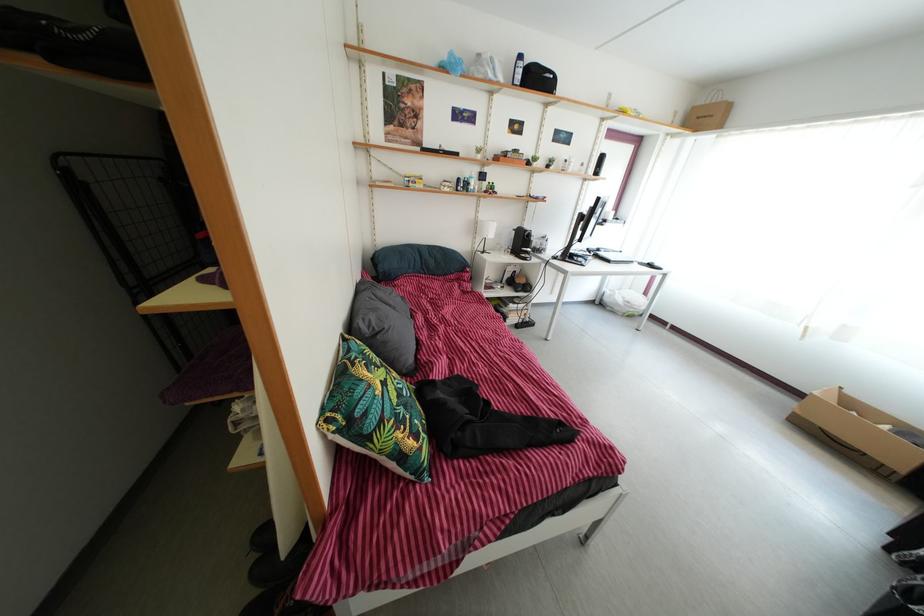
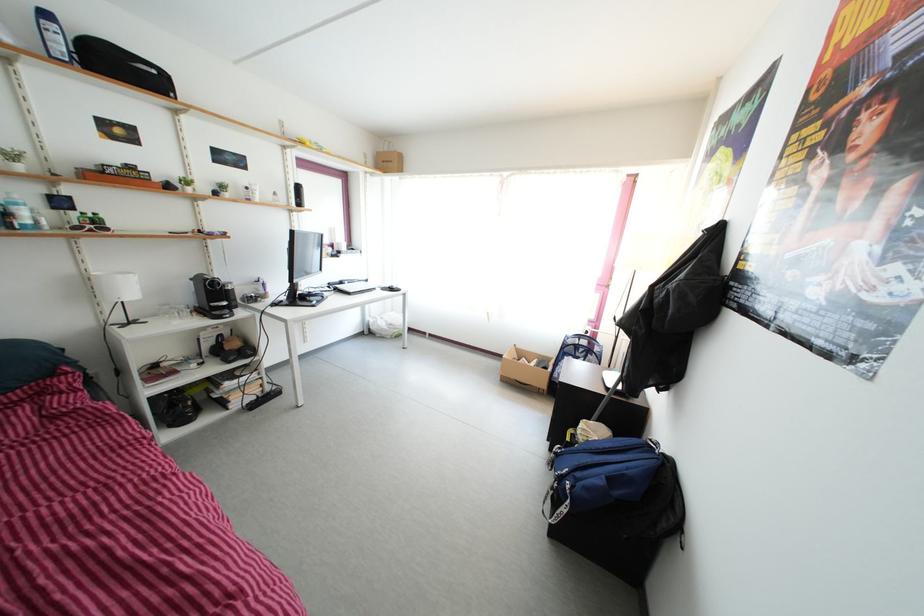
Question: The camera is either moving clockwise (left) or counter-clockwise (right) around the object. The first image is from the beginning of the video and the second image is from the end. Is the camera moving left or right when shooting the video?

Choices:
 (A) Left
 (B) Right

Answer: (A)